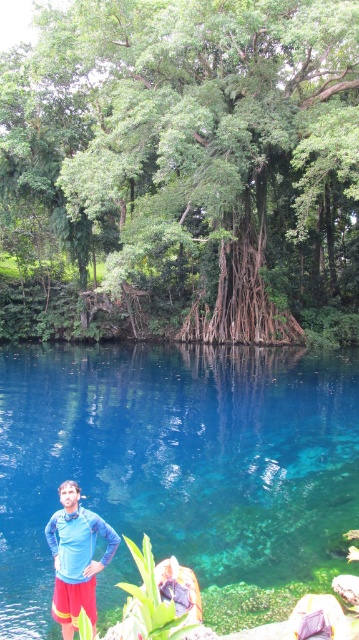
How far apart are transparent blue water at center and blue fabric shirt at lower left?

transparent blue water at center and blue fabric shirt at lower left are 8.24 meters apart from each other.

Does transparent blue water at center appear on the left side of blue fabric shirt at lower left?

Correct, you'll find transparent blue water at center to the left of blue fabric shirt at lower left.

Between point (259, 580) and point (85, 611), which one is positioned behind?

Point (259, 580)

Find the location of a particular element. The image size is (359, 640). transparent blue water at center is located at coordinates (182, 468).

Between green leafy tree at center and blue fabric shirt at lower left, which one is positioned lower?

blue fabric shirt at lower left is lower down.

Who is more forward, (113, 49) or (106, 538)?

Point (106, 538) is in front.

Is point (253, 269) positioned in front of point (48, 531)?

No, it is not.

I want to click on green leafy tree at center, so click(189, 164).

At what (x,y) coordinates should I click in order to perform the action: click on green leafy tree at center. Please return your answer as a coordinate pair (x, y). The image size is (359, 640). Looking at the image, I should click on (189, 164).

Between green leafy tree at center and transparent blue water at center, which one appears on the right side from the viewer's perspective?

Result: From the viewer's perspective, green leafy tree at center appears more on the right side.

Which is behind, point (95, 205) or point (17, 445)?

Point (95, 205)

You are a GUI agent. You are given a task and a screenshot of the screen. Output one action in this format:
    pyautogui.click(x=<x>, y=<y>)
    Task: Click on the green leafy tree at center
    
    Given the screenshot: What is the action you would take?
    tap(189, 164)